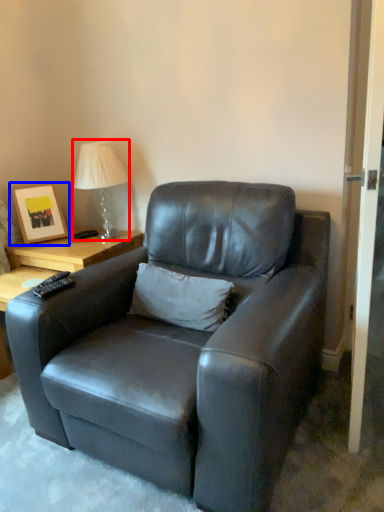
Question: Which object appears farthest to the camera in this image, table lamp (highlighted by a red box) or picture frame (highlighted by a blue box)?

Choices:
 (A) table lamp
 (B) picture frame

Answer: (B)